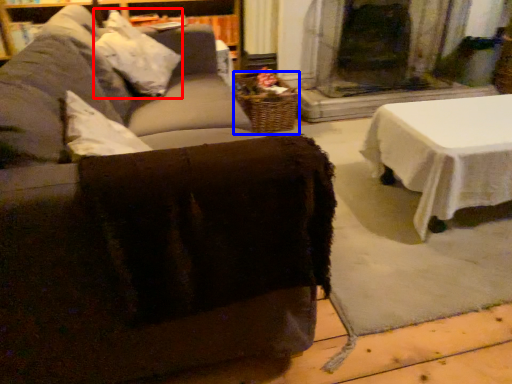
Question: Which object appears closest to the camera in this image, pillow (highlighted by a red box) or basket (highlighted by a blue box)?

Choices:
 (A) pillow
 (B) basket

Answer: (A)